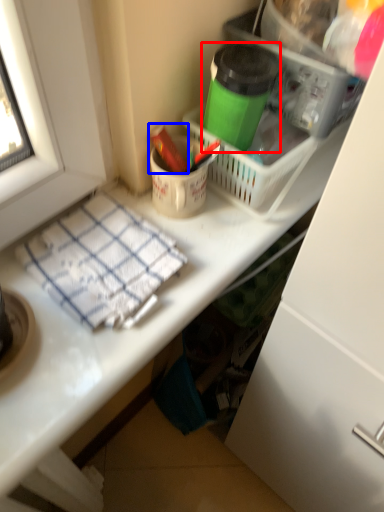
Question: Which object is closer to the camera taking this photo, bottle (highlighted by a red box) or crayon (highlighted by a blue box)?

Choices:
 (A) bottle
 (B) crayon

Answer: (A)